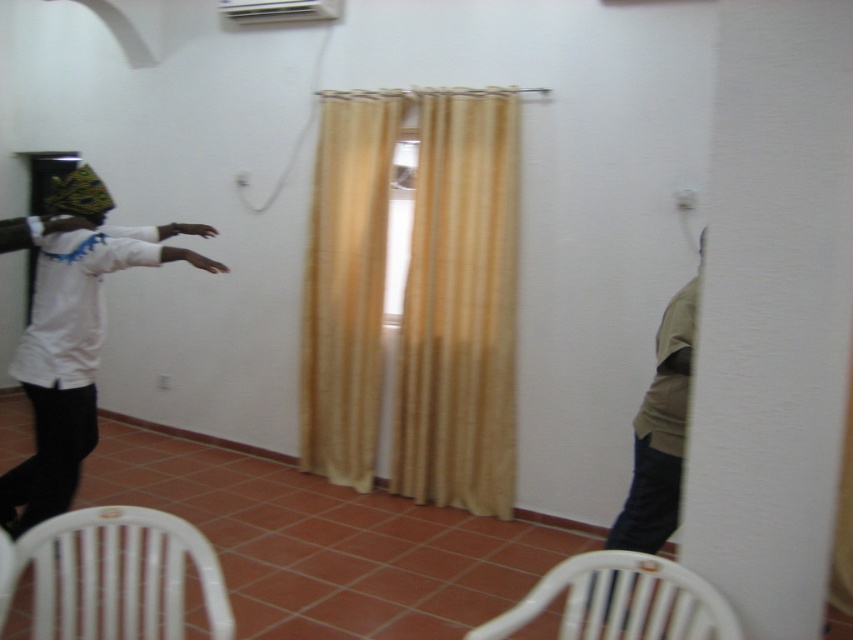
Is white plastic chair at lower left to the left of patterned fabric head at left from the viewer's perspective?

In fact, white plastic chair at lower left is to the right of patterned fabric head at left.

How much distance is there between white plastic chair at lower left and patterned fabric head at left?

white plastic chair at lower left is 5.29 feet from patterned fabric head at left.

What are the coordinates of `white plastic chair at lower left` in the screenshot? It's located at (117, 576).

You are a GUI agent. You are given a task and a screenshot of the screen. Output one action in this format:
    pyautogui.click(x=<x>, y=<y>)
    Task: Click on the white plastic chair at lower left
    
    Given the screenshot: What is the action you would take?
    pyautogui.click(x=117, y=576)

Can you confirm if beige textured curtain at center is positioned below patterned fabric head at left?

Correct, beige textured curtain at center is located below patterned fabric head at left.

Looking at this image, who is shorter, beige textured curtain at center or patterned fabric head at left?

patterned fabric head at left is shorter.

Where is `beige textured curtain at center`? This screenshot has height=640, width=853. beige textured curtain at center is located at coordinates (460, 307).

Based on the photo, between patterned fabric head at left and white plastic air conditioner at upper center, which one appears on the left side from the viewer's perspective?

patterned fabric head at left is more to the left.

Which is in front, point (82, 176) or point (236, 13)?

Positioned in front is point (82, 176).

Locate an element on the screen. The width and height of the screenshot is (853, 640). patterned fabric head at left is located at coordinates (76, 200).